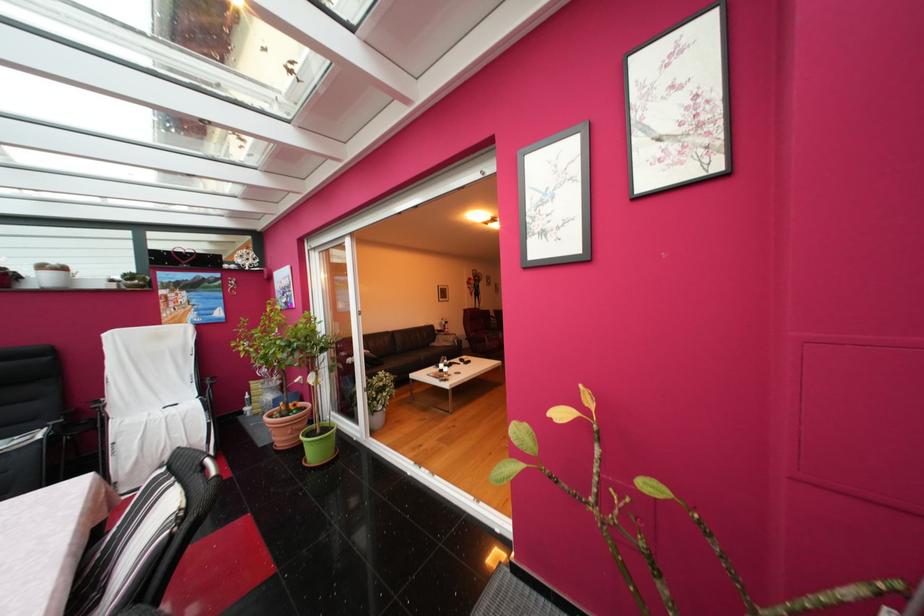
Find where to resting arm the sofa armrest. Please return your answer as a coordinate pair (x, y).

(444, 339)